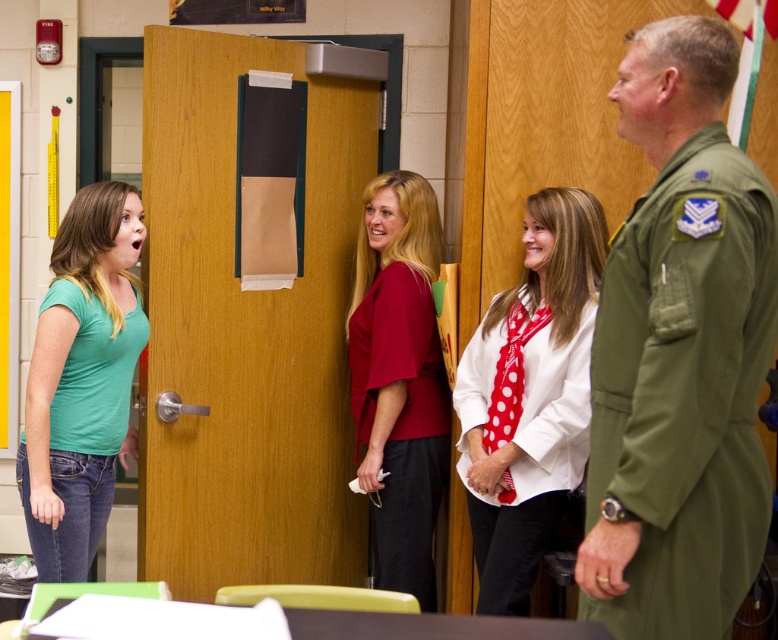
You are a photographer standing in the middle of the room. You want to take a photo of both the green matte shirt at left and the white matte shirt at center without any obstruction. Which person should you move and in which direction?

The white matte shirt at center is behind the green matte shirt at left, so you should move the white matte shirt at center forward to avoid being blocked by the green matte shirt at left.